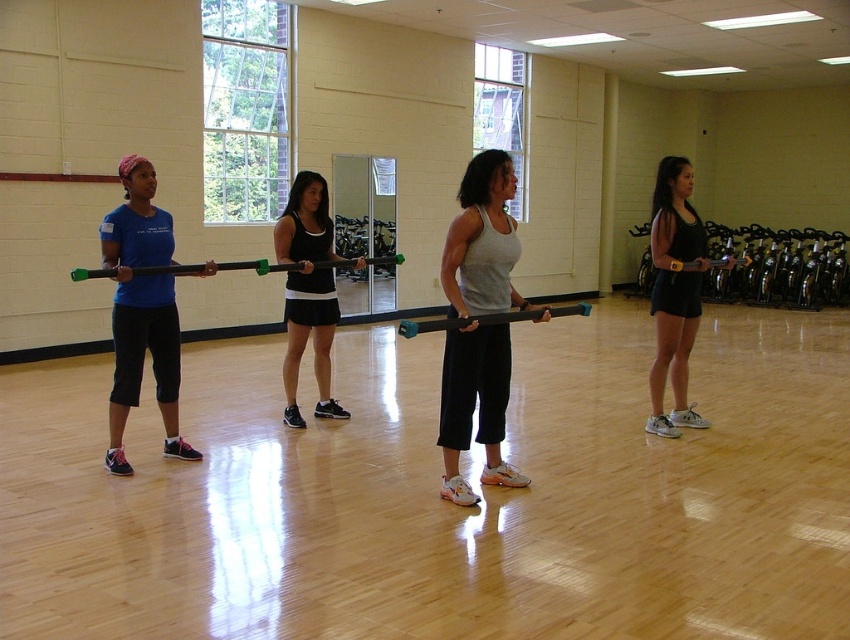
Question: Based on their relative distances, which object is farther from the black matte shorts at right?

Choices:
 (A) matte blue shirt at left
 (B) black matte tank top at center
 (C) gray matte tank top at center

Answer: (A)

Question: Which object is positioned farthest from the black matte shorts at right?

Choices:
 (A) black matte tank top at center
 (B) gray matte tank top at center

Answer: (A)

Question: Is gray matte tank top at center to the right of matte blue shirt at left from the viewer's perspective?

Choices:
 (A) no
 (B) yes

Answer: (B)

Question: Can you confirm if black matte shorts at right is smaller than black matte tank top at center?

Choices:
 (A) no
 (B) yes

Answer: (B)

Question: Which point appears closest to the camera in this image?

Choices:
 (A) (319, 182)
 (B) (650, 371)
 (C) (146, 323)

Answer: (C)

Question: Can you confirm if gray matte tank top at center is positioned above black matte shorts at right?

Choices:
 (A) yes
 (B) no

Answer: (B)